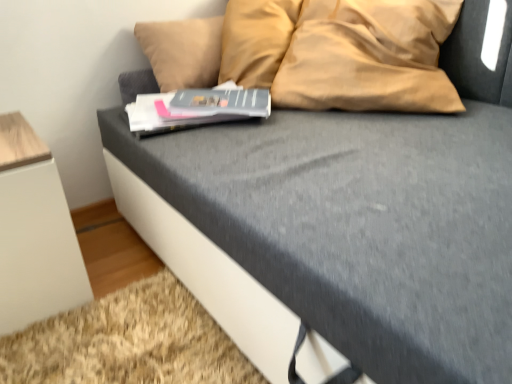
Question: Is white matte cabinet at lower left positioned in front of matte gray paperback book at center, arranged as the 1th paperback book when viewed from the back?

Choices:
 (A) yes
 (B) no

Answer: (A)

Question: From the image's perspective, is white matte cabinet at lower left located beneath matte gray paperback book at center, arranged as the 1th paperback book when viewed from the back?

Choices:
 (A) yes
 (B) no

Answer: (A)

Question: Does white matte cabinet at lower left have a greater width compared to matte gray paperback book at center, marked as the 2th paperback book in a front-to-back arrangement?

Choices:
 (A) no
 (B) yes

Answer: (B)

Question: Is there a large distance between white matte cabinet at lower left and matte gray paperback book at center, marked as the 2th paperback book in a front-to-back arrangement?

Choices:
 (A) yes
 (B) no

Answer: (B)

Question: Can you confirm if white matte cabinet at lower left is smaller than matte gray paperback book at center, arranged as the 1th paperback book when viewed from the back?

Choices:
 (A) yes
 (B) no

Answer: (B)

Question: From a real-world perspective, does white matte cabinet at lower left sit lower than matte gray paperback book at center, marked as the 2th paperback book in a front-to-back arrangement?

Choices:
 (A) yes
 (B) no

Answer: (A)

Question: Is matte gray paperback book at center, marked as the 2th paperback book in a front-to-back arrangement, oriented towards hardcover book at center, which is the 1th paperback book from front to back?

Choices:
 (A) no
 (B) yes

Answer: (A)

Question: Is matte gray paperback book at center, arranged as the 1th paperback book when viewed from the back, bigger than hardcover book at center, which is the 1th paperback book from front to back?

Choices:
 (A) yes
 (B) no

Answer: (B)

Question: Considering the relative sizes of matte gray paperback book at center, arranged as the 1th paperback book when viewed from the back, and hardcover book at center, which is the 1th paperback book from front to back, in the image provided, is matte gray paperback book at center, arranged as the 1th paperback book when viewed from the back, shorter than hardcover book at center, which is the 1th paperback book from front to back,?

Choices:
 (A) no
 (B) yes

Answer: (B)

Question: Are matte gray paperback book at center, marked as the 2th paperback book in a front-to-back arrangement, and hardcover book at center, which is the 1th paperback book from front to back, far apart?

Choices:
 (A) no
 (B) yes

Answer: (A)

Question: Is matte gray paperback book at center, arranged as the 1th paperback book when viewed from the back, located outside hardcover book at center, which is the 1th paperback book from front to back?

Choices:
 (A) yes
 (B) no

Answer: (B)

Question: From a real-world perspective, does matte gray paperback book at center, marked as the 2th paperback book in a front-to-back arrangement, stand above hardcover book at center, which is the 1th paperback book from front to back?

Choices:
 (A) no
 (B) yes

Answer: (B)

Question: From the image's perspective, is hardcover book at center, which is the 1th paperback book from front to back, above matte gray paperback book at center, marked as the 2th paperback book in a front-to-back arrangement?

Choices:
 (A) no
 (B) yes

Answer: (A)